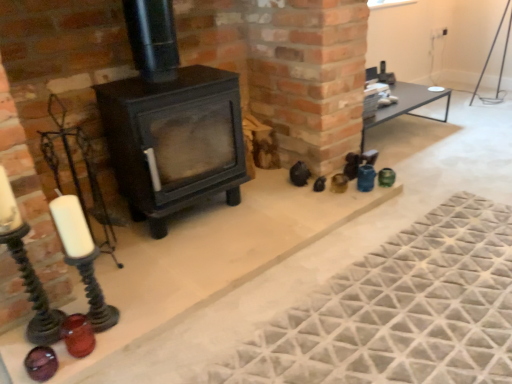
Consider the image. Measure the distance between textured gray mat at lower right and camera.

textured gray mat at lower right is 4.03 feet from camera.

The height and width of the screenshot is (384, 512). Describe the element at coordinates (287, 67) in the screenshot. I see `matte black stove at center` at that location.

The image size is (512, 384). What do you see at coordinates (170, 123) in the screenshot?
I see `matte black wood burning stove at center` at bounding box center [170, 123].

In order to face translucent amber glass candle holder at lower left, should I rotate leftwards or rightwards?

Rotate your view left by about 22.218°.

Identify the location of textured gray mat at lower right. (400, 310).

Is textured gray mat at lower right aimed at translucent amber glass candle holder at lower left?

No, textured gray mat at lower right is not aimed at translucent amber glass candle holder at lower left.

Is textured gray mat at lower right to the left or to the right of translucent amber glass candle holder at lower left in the image?

In the image, textured gray mat at lower right appears on the right side of translucent amber glass candle holder at lower left.

Is textured gray mat at lower right bigger or smaller than translucent amber glass candle holder at lower left?

Clearly, textured gray mat at lower right is larger in size than translucent amber glass candle holder at lower left.

In the scene shown: How distant is textured gray mat at lower right from translucent amber glass candle holder at lower left?

textured gray mat at lower right is 37.81 inches from translucent amber glass candle holder at lower left.

Which object is further away from the camera, matte black wood burning stove at center or translucent amber glass candle holder at lower left?

matte black wood burning stove at center is behind.

Considering the relative sizes of matte black wood burning stove at center and translucent amber glass candle holder at lower left in the image provided, is matte black wood burning stove at center smaller than translucent amber glass candle holder at lower left?

Actually, matte black wood burning stove at center might be larger than translucent amber glass candle holder at lower left.

At what (x,y) coordinates should I click in order to perform the action: click on wood burning stove behind the translucent amber glass candle holder at lower left. Please return your answer as a coordinate pair (x, y). The height and width of the screenshot is (384, 512). Looking at the image, I should click on (170, 123).

Does matte black wood burning stove at center have a lesser height compared to translucent amber glass candle holder at lower left?

Incorrect, the height of matte black wood burning stove at center does not fall short of that of translucent amber glass candle holder at lower left.

From a real-world perspective, is textured gray mat at lower right physically below matte black wood burning stove at center?

Correct, in the physical world, textured gray mat at lower right is lower than matte black wood burning stove at center.

Is point (500, 302) closer to camera compared to point (128, 107)?

Yes, it is in front of point (128, 107).

Considering the sizes of objects textured gray mat at lower right and matte black wood burning stove at center in the image provided, who is taller, textured gray mat at lower right or matte black wood burning stove at center?

Standing taller between the two is matte black wood burning stove at center.

Would you say matte black stove at center is outside translucent amber glass candle holder at lower left?

Absolutely, matte black stove at center is external to translucent amber glass candle holder at lower left.

How different are the orientations of matte black stove at center and translucent amber glass candle holder at lower left in degrees?

The angle between the facing direction of matte black stove at center and the facing direction of translucent amber glass candle holder at lower left is 90 degrees.

From a real-world perspective, is matte black stove at center on top of translucent amber glass candle holder at lower left?

No, from a real-world perspective, matte black stove at center is not over translucent amber glass candle holder at lower left

The width and height of the screenshot is (512, 384). What are the coordinates of `fireplace in front of the translucent amber glass candle holder at lower left` in the screenshot? It's located at tap(287, 67).

Does translucent amber glass candle holder at lower left have a larger size compared to textured gray mat at lower right?

Actually, translucent amber glass candle holder at lower left might be smaller than textured gray mat at lower right.

Considering their positions, is translucent amber glass candle holder at lower left located in front of or behind textured gray mat at lower right?

In the image, translucent amber glass candle holder at lower left appears behind textured gray mat at lower right.

What's the angular difference between translucent amber glass candle holder at lower left and textured gray mat at lower right's facing directions?

The angle between the facing direction of translucent amber glass candle holder at lower left and the facing direction of textured gray mat at lower right is 90 degrees.

Is translucent amber glass candle holder at lower left to the left of textured gray mat at lower right from the viewer's perspective?

Correct, you'll find translucent amber glass candle holder at lower left to the left of textured gray mat at lower right.

Can you tell me how much matte black stove at center and textured gray mat at lower right differ in facing direction?

The angular difference between matte black stove at center and textured gray mat at lower right is 1.25e-05 degrees.

From a real-world perspective, is matte black stove at center on top of textured gray mat at lower right?

Yes.

Based on the photo, could you tell me if matte black stove at center is turned towards textured gray mat at lower right?

No, matte black stove at center does not turn towards textured gray mat at lower right.

Which of these two, matte black stove at center or textured gray mat at lower right, is wider?

matte black stove at center is wider.

Which object is further away from the camera taking this photo, translucent amber glass candle holder at lower left or matte black wood burning stove at center?

matte black wood burning stove at center is further away from the camera.

From a real-world perspective, which is physically below, translucent amber glass candle holder at lower left or matte black wood burning stove at center?

In real-world perspective, translucent amber glass candle holder at lower left is lower.

Identify the location of wood burning stove behind the translucent amber glass candle holder at lower left. (170, 123).

The image size is (512, 384). I want to click on candle holder on the left of textured gray mat at lower right, so click(x=78, y=335).

Locate an element on the screen. candle holder lying below the matte black wood burning stove at center (from the image's perspective) is located at coordinates (78, 335).

From the image, which object appears to be farther from matte black wood burning stove at center, matte black stove at center or translucent amber glass candle holder at lower left?

translucent amber glass candle holder at lower left.

Based on their spatial positions, is matte black stove at center or matte black wood burning stove at center closer to textured gray mat at lower right?

Among the two, matte black wood burning stove at center is located nearer to textured gray mat at lower right.

Looking at the image, which one is located closer to translucent amber glass candle holder at lower left, textured gray mat at lower right or matte black wood burning stove at center?

matte black wood burning stove at center is positioned closer to the anchor translucent amber glass candle holder at lower left.

From the image, which object appears to be nearer to matte black stove at center, textured gray mat at lower right or translucent amber glass candle holder at lower left?

Based on the image, textured gray mat at lower right appears to be nearer to matte black stove at center.

Considering their positions, is matte black wood burning stove at center positioned further to textured gray mat at lower right than matte black stove at center?

matte black stove at center.

Consider the image. From the image, which object appears to be farther from matte black wood burning stove at center, translucent amber glass candle holder at lower left or matte black stove at center?

The object further to matte black wood burning stove at center is translucent amber glass candle holder at lower left.

When comparing their distances from translucent amber glass candle holder at lower left, does matte black stove at center or textured gray mat at lower right seem further?

Among the two, matte black stove at center is located further to translucent amber glass candle holder at lower left.

Looking at this image, which object lies further to the anchor point textured gray mat at lower right, translucent amber glass candle holder at lower left or matte black wood burning stove at center?

translucent amber glass candle holder at lower left.

In order to click on wood burning stove located between translucent amber glass candle holder at lower left and matte black stove at center in the left-right direction in this screenshot , I will do pos(170,123).

Identify the location of mat between translucent amber glass candle holder at lower left and matte black stove at center in the horizontal direction. (400, 310).

What are the coordinates of `wood burning stove between translucent amber glass candle holder at lower left and textured gray mat at lower right` in the screenshot? It's located at (170, 123).

Where is `mat situated between matte black wood burning stove at center and matte black stove at center from left to right`? mat situated between matte black wood burning stove at center and matte black stove at center from left to right is located at coordinates (400, 310).